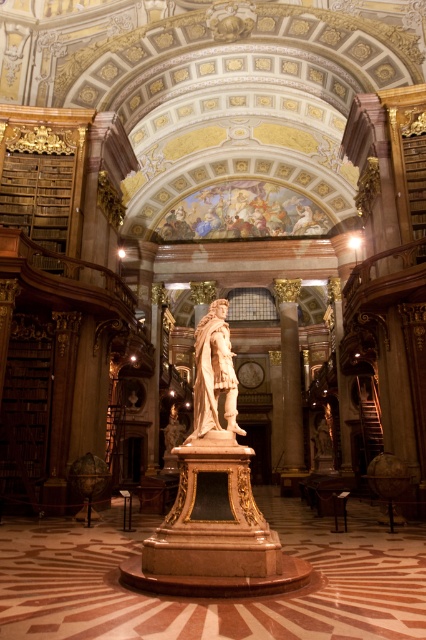
Question: Which point is closer to the camera?

Choices:
 (A) polished marble column at center
 (B) polished bronze statue at center

Answer: (B)

Question: Is polished bronze statue at center thinner than polished marble column at center?

Choices:
 (A) yes
 (B) no

Answer: (A)

Question: Which object appears farthest from the camera in this image?

Choices:
 (A) polished bronze statue at center
 (B) polished marble column at center

Answer: (B)

Question: Can you confirm if polished bronze statue at center is wider than polished marble column at center?

Choices:
 (A) no
 (B) yes

Answer: (A)

Question: Is polished bronze statue at center to the right of polished marble column at center from the viewer's perspective?

Choices:
 (A) yes
 (B) no

Answer: (B)